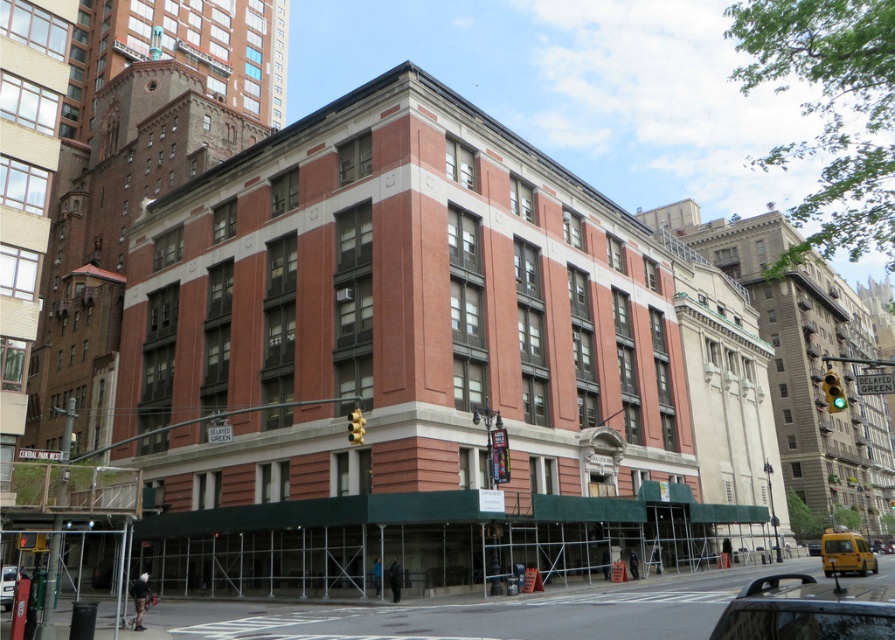
Does shiny black car at lower right have a lesser width compared to yellow matte van at lower right?

Indeed, shiny black car at lower right has a lesser width compared to yellow matte van at lower right.

Which is in front, point (751, 621) or point (861, 556)?

Point (751, 621)

Find the location of a particular element. The image size is (895, 640). shiny black car at lower right is located at coordinates click(x=807, y=611).

Between point (824, 563) and point (5, 572), which one is positioned behind?

The point (824, 563) is more distant.

Can you confirm if yellow matte van at lower right is bigger than metallic silver car at lower left?

Indeed, yellow matte van at lower right has a larger size compared to metallic silver car at lower left.

What do you see at coordinates (846, 554) in the screenshot? The image size is (895, 640). I see `yellow matte van at lower right` at bounding box center [846, 554].

Find the location of `yellow matte van at lower right`. yellow matte van at lower right is located at coordinates (846, 554).

Between shiny black car at lower right and metallic silver car at lower left, which one is positioned higher?

shiny black car at lower right is above.

Is shiny black car at lower right shorter than metallic silver car at lower left?

Incorrect, shiny black car at lower right's height does not fall short of metallic silver car at lower left's.

Locate an element on the screen. shiny black car at lower right is located at coordinates (807, 611).

At what (x,y) coordinates should I click in order to perform the action: click on shiny black car at lower right. Please return your answer as a coordinate pair (x, y). The height and width of the screenshot is (640, 895). Looking at the image, I should click on (807, 611).